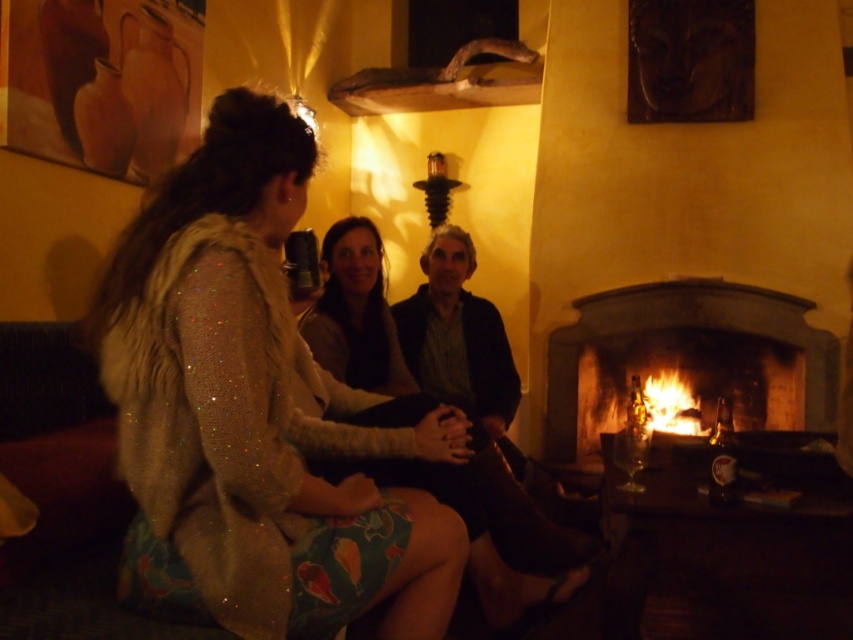
Is dark brown leather jacket at center smaller than flaming wood at right?

No.

What do you see at coordinates (459, 340) in the screenshot? The image size is (853, 640). I see `dark brown leather jacket at center` at bounding box center [459, 340].

The height and width of the screenshot is (640, 853). I want to click on dark brown leather jacket at center, so click(459, 340).

Which is in front, point (712, 321) or point (454, 225)?

Point (454, 225)

Does wooden fireplace at right have a larger size compared to dark brown leather jacket at center?

Yes, wooden fireplace at right is bigger than dark brown leather jacket at center.

At what (x,y) coordinates should I click in order to perform the action: click on wooden fireplace at right. Please return your answer as a coordinate pair (x, y). Looking at the image, I should click on (688, 358).

Is wooden fireplace at right further to camera compared to flaming wood at right?

No, it is in front of flaming wood at right.

Does wooden fireplace at right appear on the left side of flaming wood at right?

No, wooden fireplace at right is not to the left of flaming wood at right.

Is point (773, 305) less distant than point (666, 420)?

Yes, point (773, 305) is in front of point (666, 420).

Image resolution: width=853 pixels, height=640 pixels. Find the location of `wooden fireplace at right`. wooden fireplace at right is located at coordinates (688, 358).